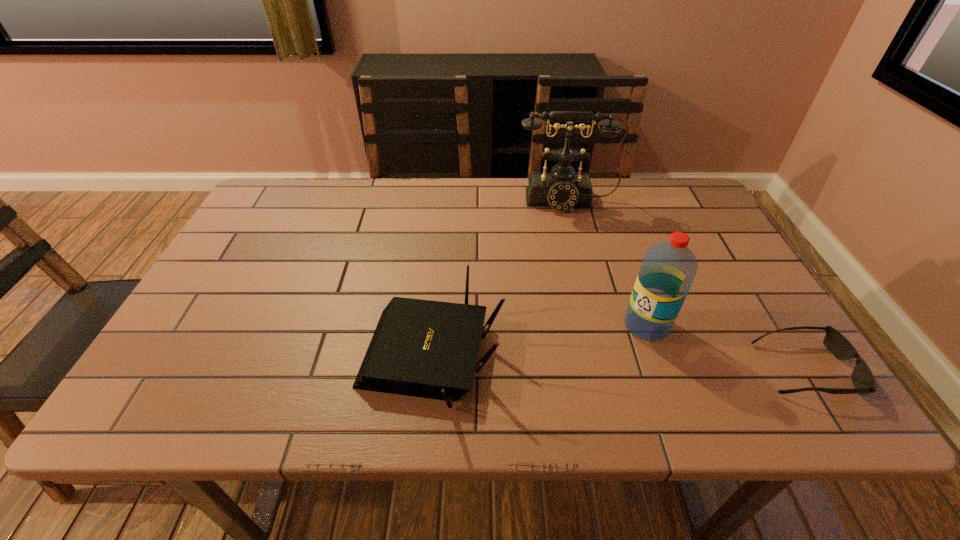
This screenshot has width=960, height=540. In the image, there is a desktop. Identify the location of free region at the right edge. (709, 314).

Where is `vacant space at the far left corner of the desktop`? The height and width of the screenshot is (540, 960). vacant space at the far left corner of the desktop is located at coordinates (244, 222).

I want to click on vacant space at the near right corner of the desktop, so click(795, 353).

Find the location of a particular element. empty location between the sunglasses and the router is located at coordinates (618, 364).

Where is `vacant region between the third tallest object and the farthest object`? vacant region between the third tallest object and the farthest object is located at coordinates (499, 280).

At what (x,y) coordinates should I click in order to perform the action: click on empty space that is in between the water bottle and the telephone. Please return your answer as a coordinate pair (x, y). The height and width of the screenshot is (540, 960). Looking at the image, I should click on tap(607, 263).

Where is `vacant point located between the water bottle and the rightmost object`? Image resolution: width=960 pixels, height=540 pixels. vacant point located between the water bottle and the rightmost object is located at coordinates (726, 347).

Find the location of a particular element. free spot between the water bottle and the sunglasses is located at coordinates (726, 347).

Where is `vacant region between the shortest object and the water bottle`? The width and height of the screenshot is (960, 540). vacant region between the shortest object and the water bottle is located at coordinates (726, 347).

Find the location of a particular element. This screenshot has width=960, height=540. unoccupied position between the telephone and the water bottle is located at coordinates (607, 263).